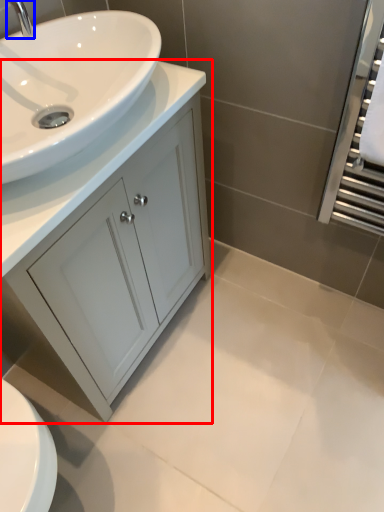
Question: Which point is further to the camera, bathroom cabinet (highlighted by a red box) or tap (highlighted by a blue box)?

Choices:
 (A) bathroom cabinet
 (B) tap

Answer: (A)